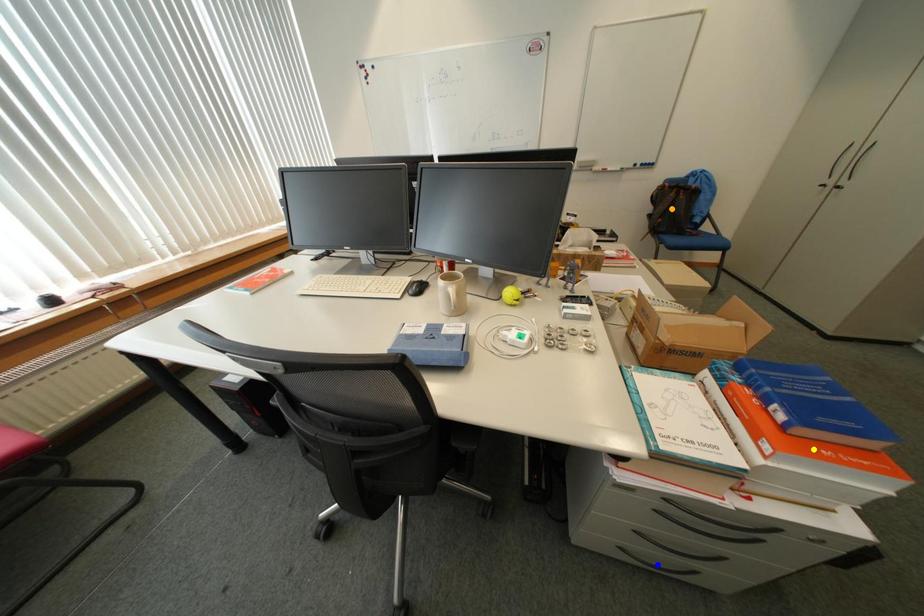
Order these from nearest to farthest:
yellow point | orange point | blue point

1. orange point
2. blue point
3. yellow point